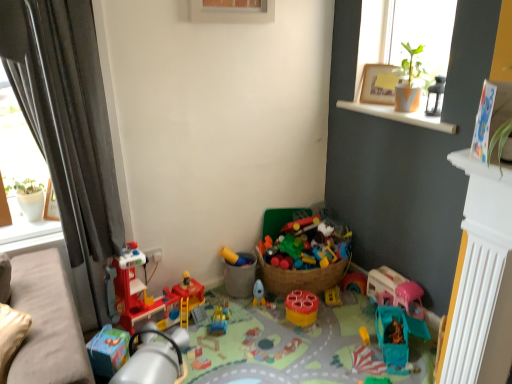
Find the location of `free location to the left of matte plastic cup at center, the sixth toy from the left`. free location to the left of matte plastic cup at center, the sixth toy from the left is located at coordinates (272, 316).